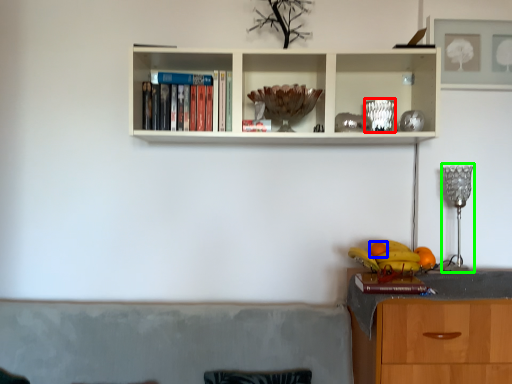
Question: Which is farther away from glass vase (highlighted by a red box)? orange (highlighted by a blue box) or lamp (highlighted by a green box)?

Choices:
 (A) orange
 (B) lamp

Answer: (A)